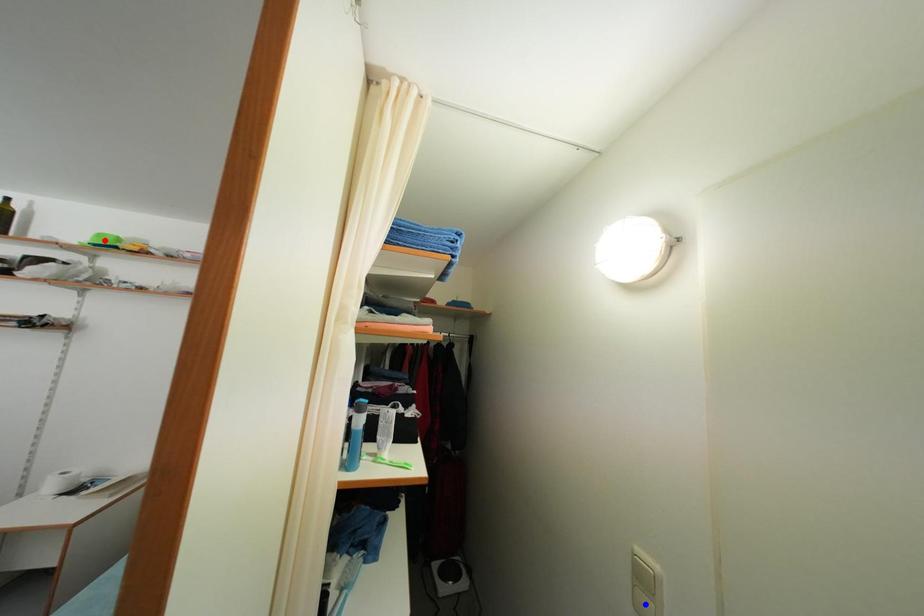
Question: Which of the two points in the image is closer to the camera?

Choices:
 (A) Blue point is closer.
 (B) Red point is closer.

Answer: (A)